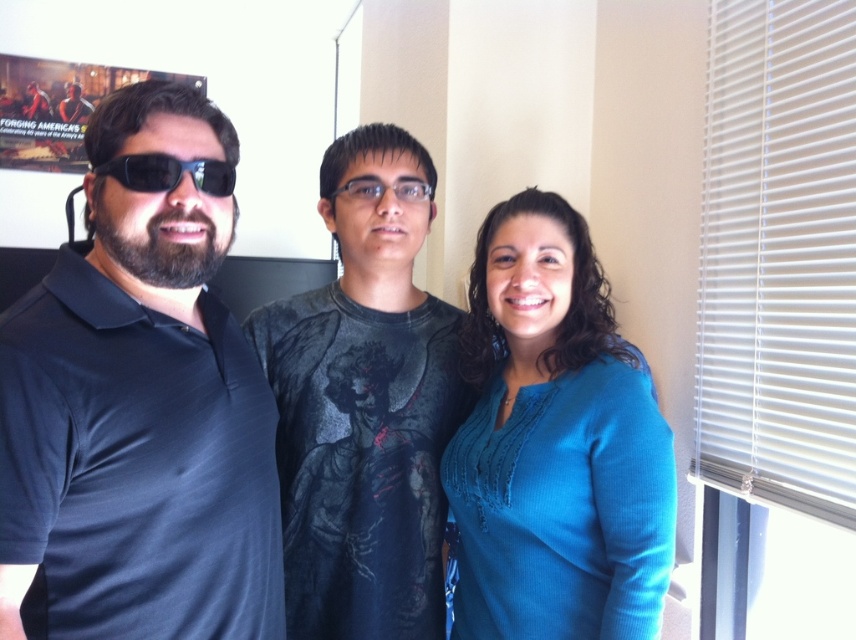
Is blue knit sweater at center closer to camera compared to matte black polo shirt at left?

Yes.

Can you confirm if blue knit sweater at center is positioned to the left of matte black polo shirt at left?

Yes, blue knit sweater at center is to the left of matte black polo shirt at left.

What do you see at coordinates (135, 436) in the screenshot? I see `blue knit sweater at center` at bounding box center [135, 436].

Locate an element on the screen. blue knit sweater at center is located at coordinates (135, 436).

Measure the distance between point (296, 403) and camera.

Point (296, 403) is 1.43 meters away from camera.

Between dark gray printed shirt at center and matte black goggles at left, which one is positioned lower?

dark gray printed shirt at center

This screenshot has height=640, width=856. Find the location of `dark gray printed shirt at center`. dark gray printed shirt at center is located at coordinates (366, 404).

Measure the distance between point (15, 372) and camera.

35.62 inches

Between point (223, 637) and point (388, 380), which one is positioned behind?

The point (388, 380) is behind.

The width and height of the screenshot is (856, 640). Identify the location of matte black polo shirt at left. (138, 435).